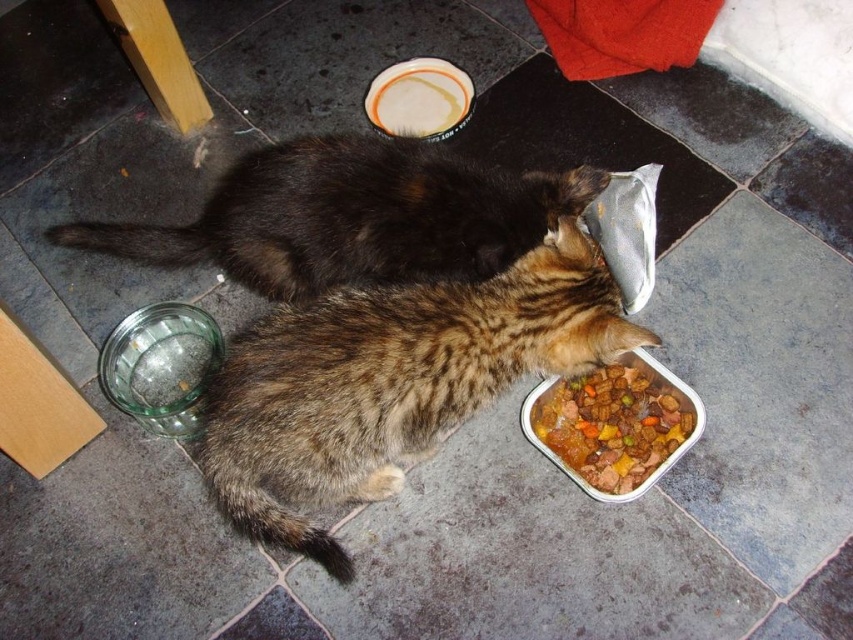
You are a cat owner who wants to place a new toy on the floor between the brown textured fur cat at lower center and the white glossy plate at upper center. Considering their relative sizes, which object should the toy be placed closer to?

The toy should be placed closer to the white glossy plate at upper center because the brown textured fur cat at lower center is taller than the plate, so the plate is shorter and the toy can be placed near it without being blocked by the cat.

You are a cat owner who wants to place a new toy between the brown textured fur cat at lower center and the dark brown fur cat at center. Based on their positions, where should you place the toy so it is equidistant from both cats?

To place the toy equidistant from both cats, position it midway between the brown textured fur cat at lower center and the dark brown fur cat at center since the brown textured fur cat is below the dark brown fur cat.